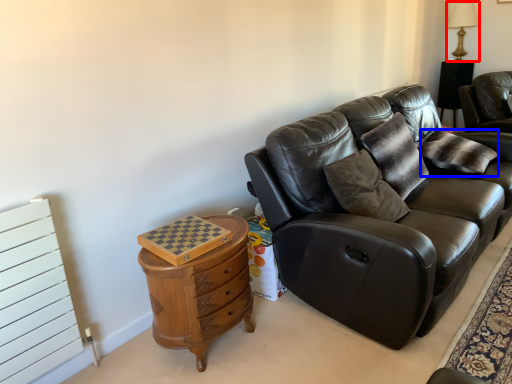
Question: Which object is further to the camera taking this photo, table lamp (highlighted by a red box) or pillow (highlighted by a blue box)?

Choices:
 (A) table lamp
 (B) pillow

Answer: (A)